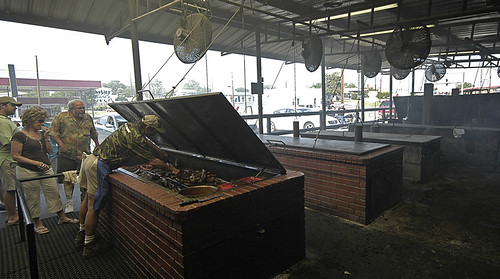
I want to click on underneath side of oven lid, so click(x=187, y=121).